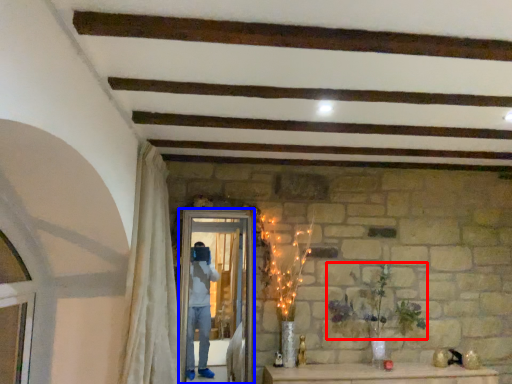
Question: Which point is further to the camera, plant (highlighted by a red box) or screen door (highlighted by a blue box)?

Choices:
 (A) plant
 (B) screen door

Answer: (A)